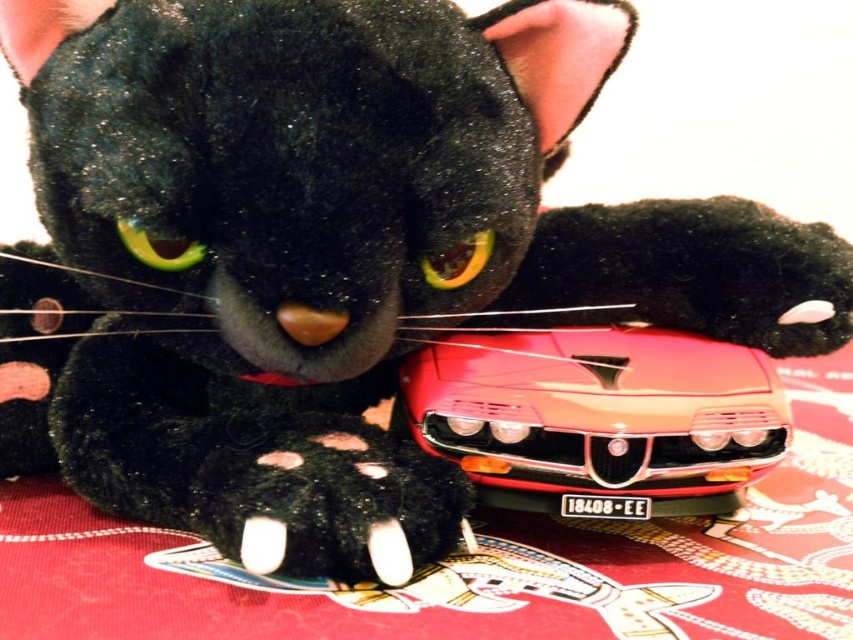
Is red fabric tablecloth at center bigger than shiny red plastic toy car at center?

Correct, red fabric tablecloth at center is larger in size than shiny red plastic toy car at center.

Is red fabric tablecloth at center shorter than shiny red plastic toy car at center?

No.

Between point (651, 582) and point (554, 364), which one is positioned in front?

Point (651, 582) is in front.

Image resolution: width=853 pixels, height=640 pixels. Identify the location of red fabric tablecloth at center. (474, 564).

Is red fabric tablecloth at center smaller than black fuzzy paw at lower center?

Actually, red fabric tablecloth at center might be larger than black fuzzy paw at lower center.

Is point (248, 614) positioned before point (291, 532)?

That is True.

Is point (86, 632) positioned in front of point (373, 496)?

Yes, it is.

Where is `red fabric tablecloth at center`? Image resolution: width=853 pixels, height=640 pixels. red fabric tablecloth at center is located at coordinates (474, 564).

Which of these two, shiny red plastic toy car at center or black fuzzy paw at lower center, stands shorter?

With less height is black fuzzy paw at lower center.

Which is above, shiny red plastic toy car at center or black fuzzy paw at lower center?

Positioned higher is shiny red plastic toy car at center.

Based on the photo, measure the distance between shiny red plastic toy car at center and camera.

They are 17.42 inches apart.

You are a GUI agent. You are given a task and a screenshot of the screen. Output one action in this format:
    pyautogui.click(x=<x>, y=<y>)
    Task: Click on the shiny red plastic toy car at center
    The height and width of the screenshot is (640, 853).
    Given the screenshot: What is the action you would take?
    coord(596,419)